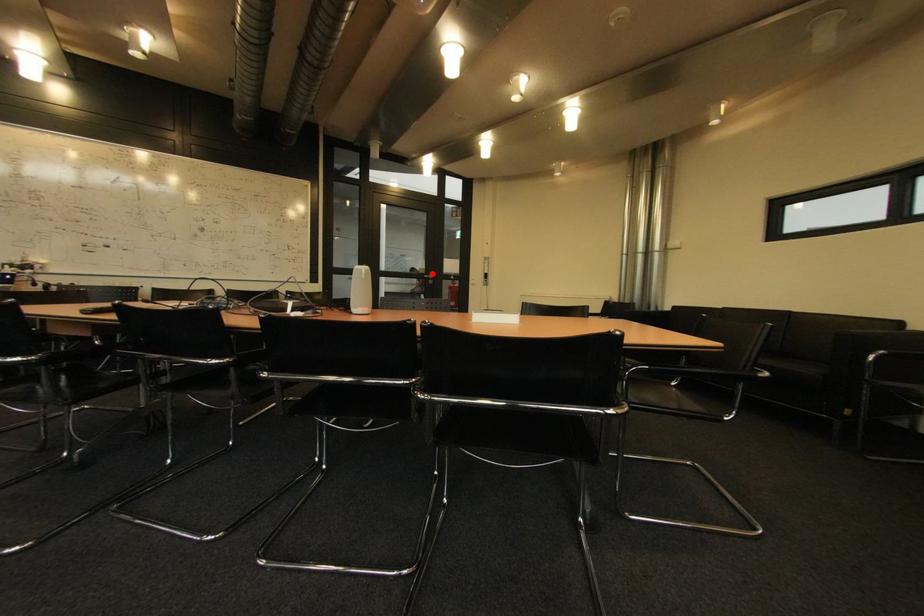
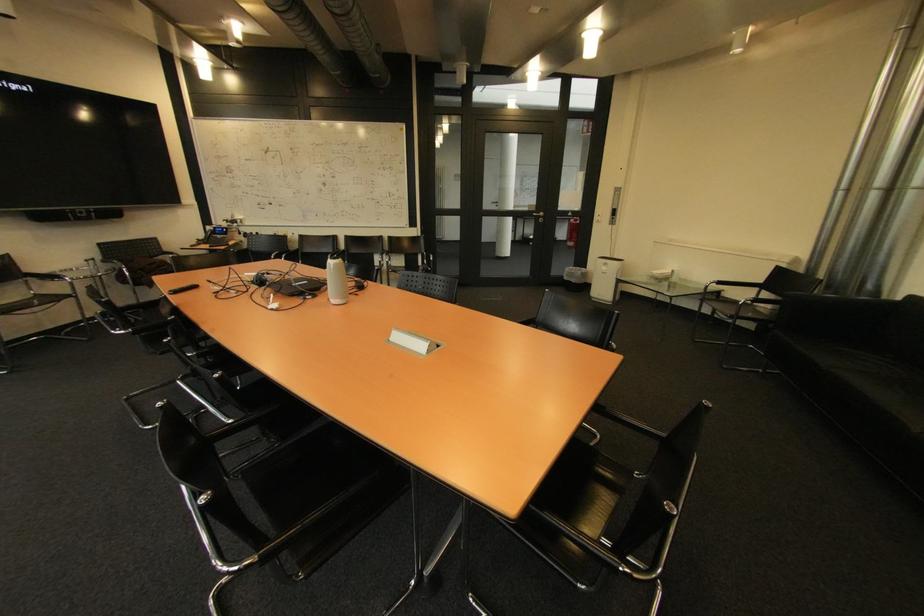
Find the pixel in the second image that matches the highlighted location in the first image.

(542, 209)